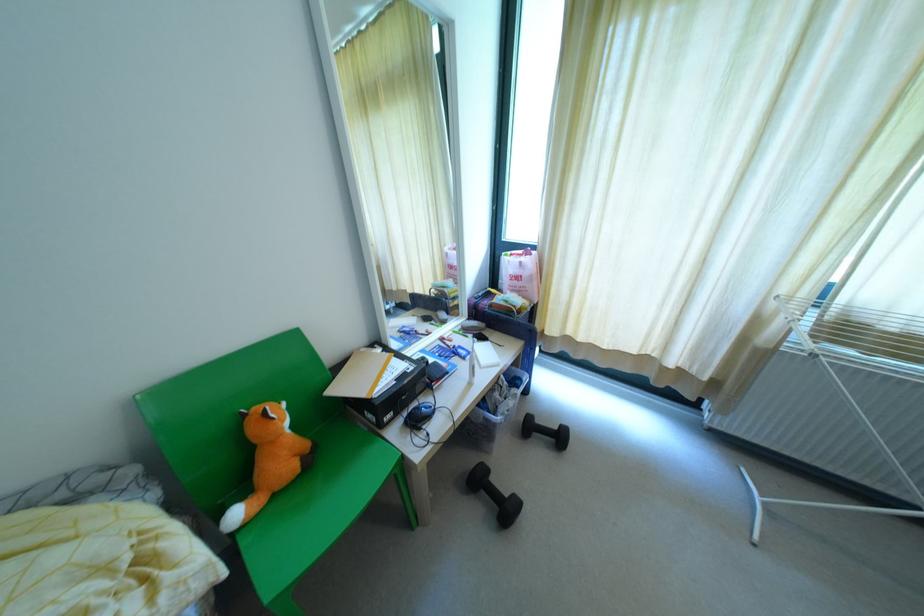
Image resolution: width=924 pixels, height=616 pixels. Find the location of `tan file folder`. tan file folder is located at coordinates (359, 374).